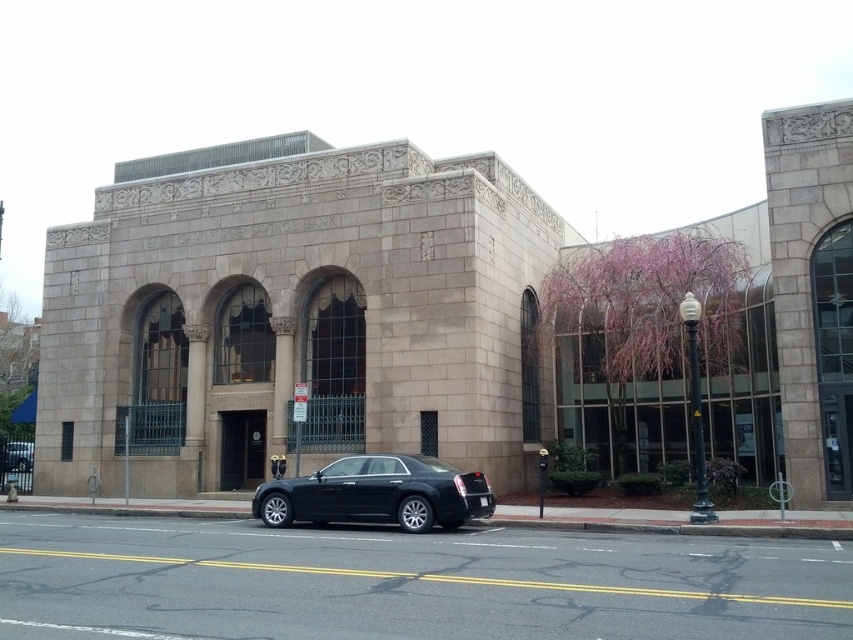
You are a delivery driver who needs to park your truck, which is 2 meters wide, in the parking spot in front of East Cambridge Savings Bank. There are two sedans present. Can you fit your truck between the black metallic sedan at center and the black glossy sedan at center?

The black metallic sedan at center is wider than the black glossy sedan at center. However, the total width between them is not provided, so it is impossible to determine if the truck can fit without additional information.

You are a parking attendant who needs to fit both the black metallic sedan at center and the black glossy sedan at center into a parking spot that can only accommodate one car. Which car should you choose to park?

The parking spot can only accommodate one car. Since the black metallic sedan at center is larger in size than the black glossy sedan at center, you should choose to park the black glossy sedan at center as it is smaller and more likely to fit within the space.